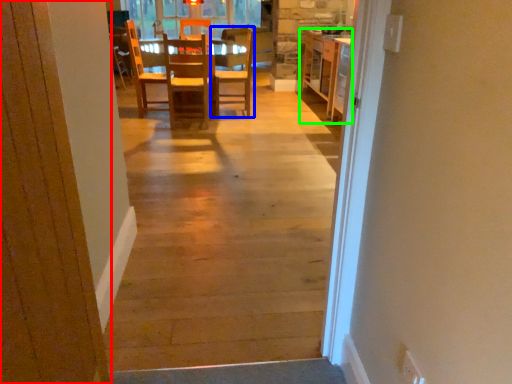
Question: Which object is the farthest from door (highlighted by a red box)? Choose among these: chair (highlighted by a blue box) or cabinetry (highlighted by a green box).

Choices:
 (A) chair
 (B) cabinetry

Answer: (B)